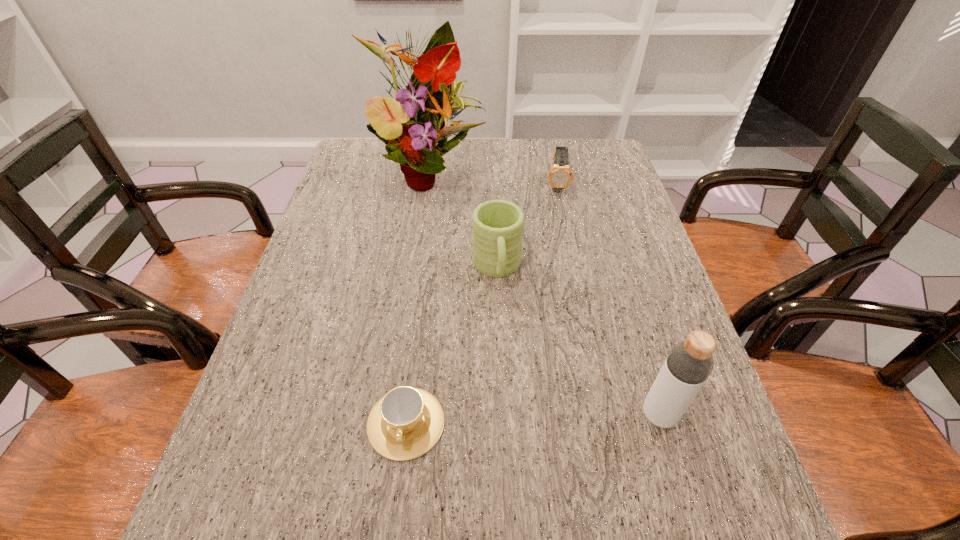
Locate an element on the screen. free space on the desktop that is between the shortest object and the second tallest object and is positioned on the face of the watch is located at coordinates (570, 418).

Locate an element on the screen. The width and height of the screenshot is (960, 540). free spot on the desktop that is between the shortest object and the rightmost object and is positioned on the side of the third shortest object with the handle is located at coordinates (516, 420).

You are a GUI agent. You are given a task and a screenshot of the screen. Output one action in this format:
    pyautogui.click(x=<x>, y=<y>)
    Task: Click on the vacant spot on the desktop that is between the shortest object and the bottle and is positioned on the front-facing side of the bouquet
    The height and width of the screenshot is (540, 960).
    Given the screenshot: What is the action you would take?
    pyautogui.click(x=542, y=418)